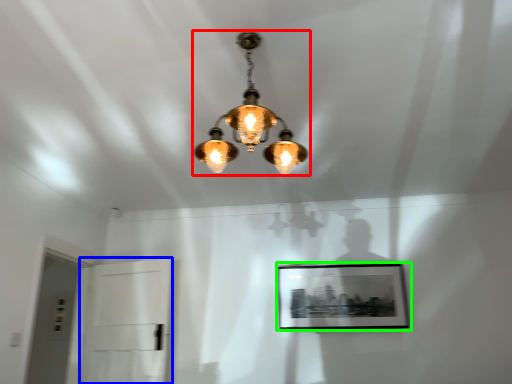
Question: Which object is positioned farthest from lamp (highlighted by a red box)? Select from glass door (highlighted by a blue box) and picture frame (highlighted by a green box).

Choices:
 (A) glass door
 (B) picture frame

Answer: (A)